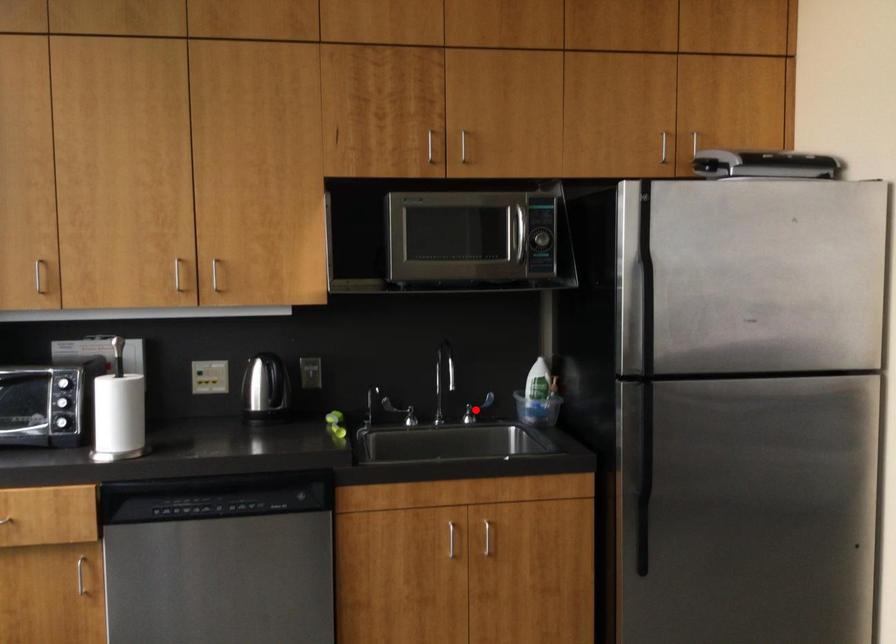
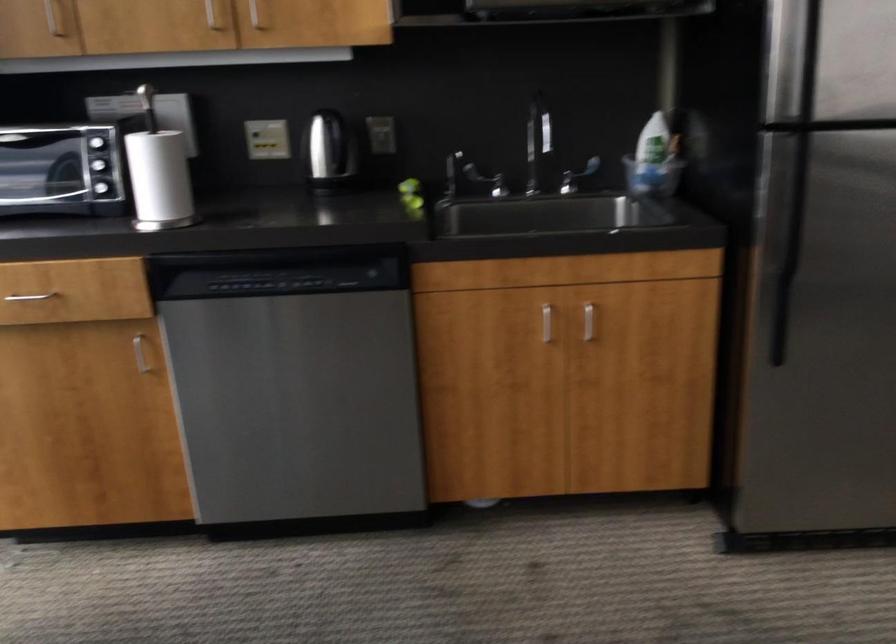
Find the pixel in the second image that matches the highlighted location in the first image.

(576, 176)